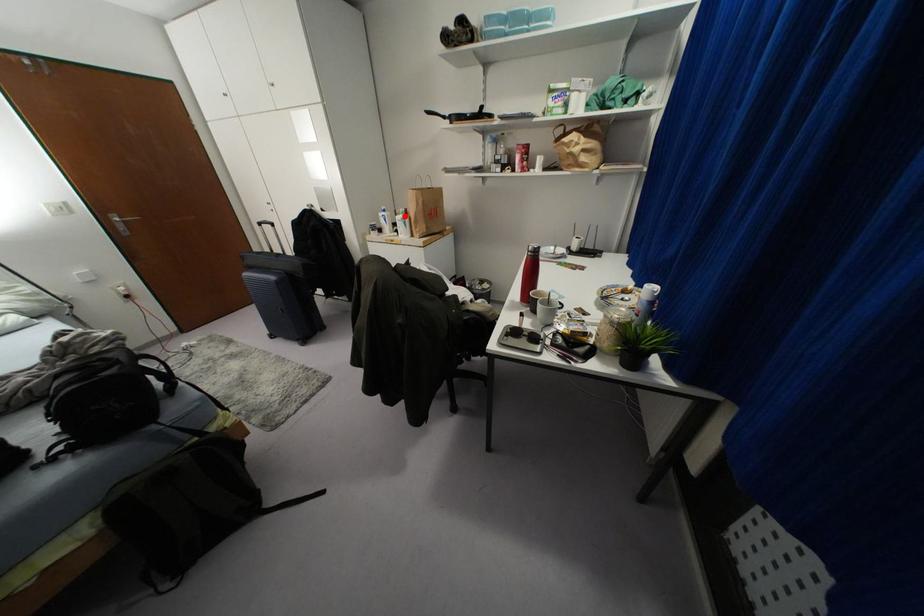
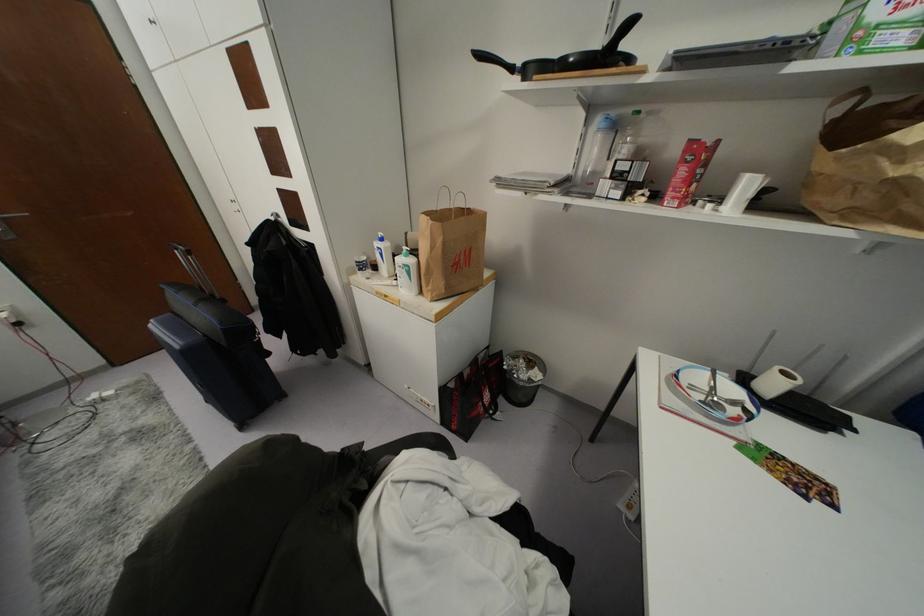
Question: I am providing you with two images of the same scene from different viewpoints. A red point is shown in image1. For the corresponding object point in image2, is it positioned nearer or farther from the camera?

Choices:
 (A) Nearer
 (B) Farther

Answer: (B)